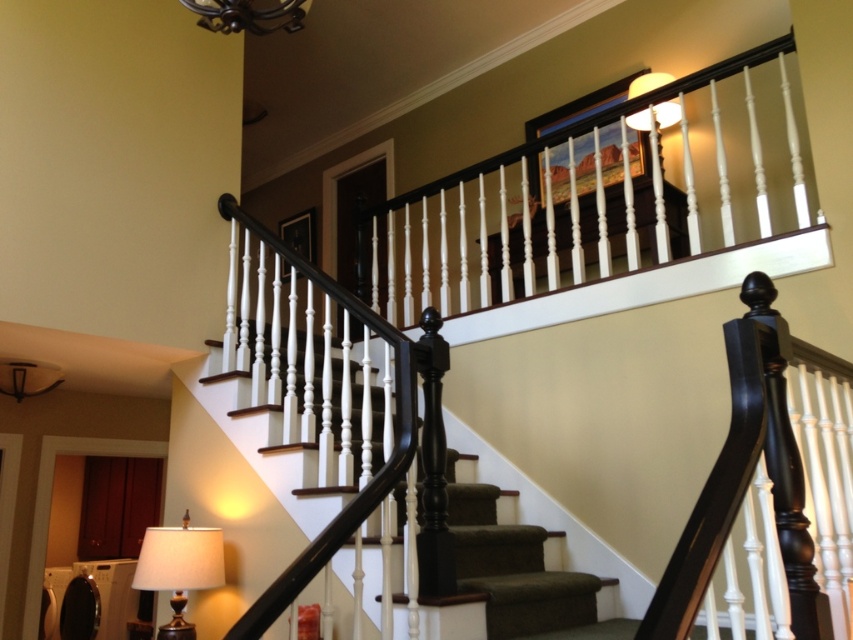
You are an interior designer assessing the lighting in this space. You notice the gold metallic lamp at lower left and the matte white lampshade at upper center. Which lamp has a smaller size?

The gold metallic lamp at lower left has a smaller size compared to the matte white lampshade at upper center.